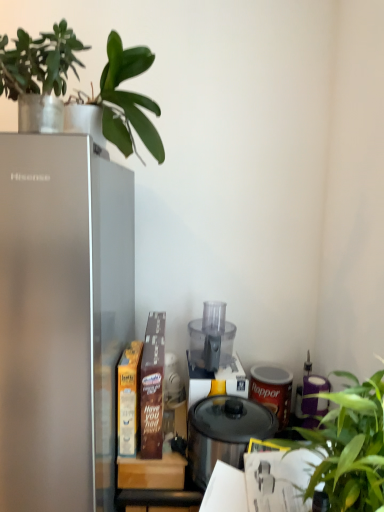
In order to click on green leafy plant at right, the first houseplant when ordered from bottom to top in this screenshot , I will do `click(350, 446)`.

At what (x,y) coordinates should I click in order to perform the action: click on satin silver refrigerator at left. Please return your answer as a coordinate pair (x, y). Looking at the image, I should click on (59, 313).

This screenshot has height=512, width=384. Describe the element at coordinates (213, 356) in the screenshot. I see `transparent plastic blender at center` at that location.

Find the location of `black glossy pressure cooker at center`. black glossy pressure cooker at center is located at coordinates (224, 433).

The image size is (384, 512). What do you see at coordinates (224, 433) in the screenshot? I see `black glossy pressure cooker at center` at bounding box center [224, 433].

Identify the location of green leafy plant at right, marked as the 1th houseplant in a right-to-left arrangement. This screenshot has width=384, height=512. (350, 446).

From a real-world perspective, which is physically below, green leafy plant at right, acting as the second houseplant starting from the top, or green matte plant at upper left, positioned as the 2th houseplant in bottom-to-top order?

green leafy plant at right, acting as the second houseplant starting from the top.

Does green leafy plant at right, the first houseplant when ordered from bottom to top, come in front of green matte plant at upper left, which ranks as the first houseplant in left-to-right order?

Yes.

Consider the image. Considering the relative sizes of green leafy plant at right, marked as the 1th houseplant in a right-to-left arrangement, and green matte plant at upper left, placed as the 1th houseplant when sorted from top to bottom, in the image provided, is green leafy plant at right, marked as the 1th houseplant in a right-to-left arrangement, bigger than green matte plant at upper left, placed as the 1th houseplant when sorted from top to bottom,?

Correct, green leafy plant at right, marked as the 1th houseplant in a right-to-left arrangement, is larger in size than green matte plant at upper left, placed as the 1th houseplant when sorted from top to bottom.

Measure the distance from green leafy plant at right, acting as the second houseplant starting from the top, to green matte plant at upper left, positioned as the 2th houseplant in bottom-to-top order.

They are 36.86 inches apart.

In the scene shown: Would you say green matte plant at upper left, which is the second houseplant in right-to-left order, is part of black glossy pressure cooker at center's contents?

No.

Is black glossy pressure cooker at center with green matte plant at upper left, positioned as the 2th houseplant in bottom-to-top order?

black glossy pressure cooker at center is not next to green matte plant at upper left, positioned as the 2th houseplant in bottom-to-top order, and they're not touching.

From a real-world perspective, which is physically below, black glossy pressure cooker at center or green matte plant at upper left, positioned as the 2th houseplant in bottom-to-top order?

black glossy pressure cooker at center.

Could you tell me if transparent plastic blender at center is facing green leafy plant at right, which is the second houseplant from left to right?

Yes.

Is transparent plastic blender at center spatially inside green leafy plant at right, which is the second houseplant from left to right, or outside of it?

transparent plastic blender at center is outside green leafy plant at right, which is the second houseplant from left to right.

From a real-world perspective, which is physically below, transparent plastic blender at center or green leafy plant at right, acting as the second houseplant starting from the top?

green leafy plant at right, acting as the second houseplant starting from the top, is physically lower.

Is satin silver refrigerator at left inside green leafy plant at right, which is the second houseplant from left to right?

No, satin silver refrigerator at left is not surrounded by green leafy plant at right, which is the second houseplant from left to right.

Is green leafy plant at right, which is the second houseplant from left to right, oriented away from satin silver refrigerator at left?

No, green leafy plant at right, which is the second houseplant from left to right,'s orientation is not away from satin silver refrigerator at left.

Who is smaller, green leafy plant at right, acting as the second houseplant starting from the top, or satin silver refrigerator at left?

With smaller size is green leafy plant at right, acting as the second houseplant starting from the top.

Which object is positioned more to the right, green leafy plant at right, which is the second houseplant from left to right, or satin silver refrigerator at left?

Positioned to the right is green leafy plant at right, which is the second houseplant from left to right.

Is black glossy pressure cooker at center looking in the opposite direction of satin silver refrigerator at left?

black glossy pressure cooker at center does not have its back to satin silver refrigerator at left.

Considering the relative positions of black glossy pressure cooker at center and satin silver refrigerator at left in the image provided, is black glossy pressure cooker at center to the left or to the right of satin silver refrigerator at left?

black glossy pressure cooker at center is to the right of satin silver refrigerator at left.

From the picture: From a real-world perspective, is black glossy pressure cooker at center under satin silver refrigerator at left?

Yes, from a real-world perspective, black glossy pressure cooker at center is below satin silver refrigerator at left.

Considering the relative sizes of black glossy pressure cooker at center and satin silver refrigerator at left in the image provided, is black glossy pressure cooker at center thinner than satin silver refrigerator at left?

Yes, black glossy pressure cooker at center is thinner than satin silver refrigerator at left.

From the picture: Is the depth of green leafy plant at right, marked as the 1th houseplant in a right-to-left arrangement, greater than that of transparent plastic blender at center?

No, green leafy plant at right, marked as the 1th houseplant in a right-to-left arrangement, is closer to the camera.

Which is more to the left, green leafy plant at right, acting as the second houseplant starting from the top, or transparent plastic blender at center?

From the viewer's perspective, transparent plastic blender at center appears more on the left side.

Is green leafy plant at right, marked as the 1th houseplant in a right-to-left arrangement, wider than transparent plastic blender at center?

Correct, the width of green leafy plant at right, marked as the 1th houseplant in a right-to-left arrangement, exceeds that of transparent plastic blender at center.

Does green leafy plant at right, acting as the second houseplant starting from the top, turn towards transparent plastic blender at center?

No, green leafy plant at right, acting as the second houseplant starting from the top, is not oriented towards transparent plastic blender at center.

Is transparent plastic blender at center not near black glossy pressure cooker at center?

No, transparent plastic blender at center is not far from black glossy pressure cooker at center.

Based on their positions, is transparent plastic blender at center located to the left or right of black glossy pressure cooker at center?

From the image, it's evident that transparent plastic blender at center is to the left of black glossy pressure cooker at center.

Does transparent plastic blender at center contain black glossy pressure cooker at center?

Definitely not — black glossy pressure cooker at center is not inside transparent plastic blender at center.

Is transparent plastic blender at center facing away from black glossy pressure cooker at center?

No, transparent plastic blender at center is not facing the opposite direction of black glossy pressure cooker at center.

I want to click on houseplant located above the green leafy plant at right, the first houseplant when ordered from bottom to top (from a real-world perspective), so click(x=39, y=74).

The width and height of the screenshot is (384, 512). There is a black glossy pressure cooker at center. What are the coordinates of `the 2nd houseplant above it (from the image's perspective)` in the screenshot? It's located at (39, 74).

Looking at the image, which one is located further to black glossy pressure cooker at center, green leafy plant at right, which is the second houseplant from left to right, or satin silver refrigerator at left?

Based on the image, satin silver refrigerator at left appears to be further to black glossy pressure cooker at center.

Estimate the real-world distances between objects in this image. Which object is further from transparent plastic blender at center, black glossy pressure cooker at center or satin silver refrigerator at left?

satin silver refrigerator at left lies further to transparent plastic blender at center than the other object.

Estimate the real-world distances between objects in this image. Which object is closer to transparent plastic blender at center, satin silver refrigerator at left or green leafy plant at right, the first houseplant when ordered from bottom to top?

Among the two, green leafy plant at right, the first houseplant when ordered from bottom to top, is located nearer to transparent plastic blender at center.

From the image, which object appears to be nearer to transparent plastic blender at center, satin silver refrigerator at left or black glossy pressure cooker at center?

black glossy pressure cooker at center is positioned closer to the anchor transparent plastic blender at center.

Based on their spatial positions, is green matte plant at upper left, placed as the 1th houseplant when sorted from top to bottom, or green leafy plant at right, the first houseplant when ordered from bottom to top, closer to black glossy pressure cooker at center?

Among the two, green leafy plant at right, the first houseplant when ordered from bottom to top, is located nearer to black glossy pressure cooker at center.

Estimate the real-world distances between objects in this image. Which object is further from satin silver refrigerator at left, black glossy pressure cooker at center or green matte plant at upper left, which ranks as the first houseplant in left-to-right order?

black glossy pressure cooker at center lies further to satin silver refrigerator at left than the other object.

Which object lies nearer to the anchor point green matte plant at upper left, positioned as the 2th houseplant in bottom-to-top order, transparent plastic blender at center or satin silver refrigerator at left?

Based on the image, satin silver refrigerator at left appears to be nearer to green matte plant at upper left, positioned as the 2th houseplant in bottom-to-top order.

Which object lies nearer to the anchor point satin silver refrigerator at left, green matte plant at upper left, positioned as the 2th houseplant in bottom-to-top order, or transparent plastic blender at center?

Among the two, green matte plant at upper left, positioned as the 2th houseplant in bottom-to-top order, is located nearer to satin silver refrigerator at left.

This screenshot has width=384, height=512. I want to click on pressure cooker between green leafy plant at right, acting as the second houseplant starting from the top, and transparent plastic blender at center from front to back, so click(x=224, y=433).

At what (x,y) coordinates should I click in order to perform the action: click on houseplant between green matte plant at upper left, placed as the 1th houseplant when sorted from top to bottom, and black glossy pressure cooker at center in the up-down direction. Please return your answer as a coordinate pair (x, y). Looking at the image, I should click on (350, 446).

Locate an element on the screen. This screenshot has width=384, height=512. refrigerator between green matte plant at upper left, positioned as the 2th houseplant in bottom-to-top order, and black glossy pressure cooker at center in the up-down direction is located at coordinates (59, 313).

This screenshot has width=384, height=512. I want to click on blender between green matte plant at upper left, positioned as the 2th houseplant in bottom-to-top order, and black glossy pressure cooker at center from top to bottom, so click(x=213, y=356).